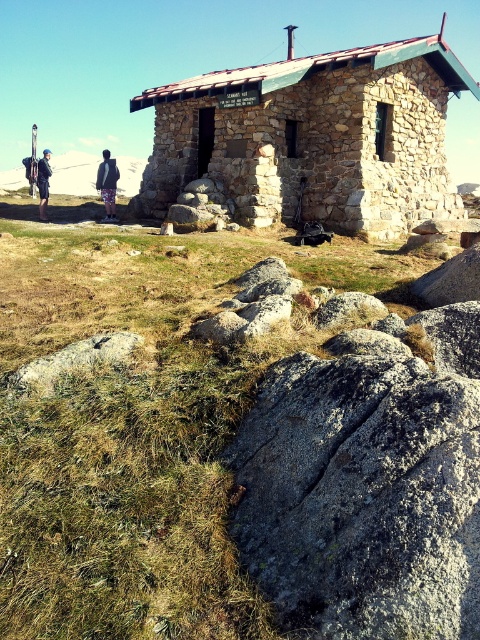
Looking at this image, you are a hiker who has reached the stone cabin at center and the printed fabric pants at center. Which object is positioned to the left?

The printed fabric pants at center are positioned to the left of the stone cabin at center.

You are an outdoor enthusiast planning to store your equipment in a small shed. You have the matte black skis at left and the printed fabric pants at center. Given their sizes, which item would require more storage space?

The matte black skis at left has a larger size compared to the printed fabric pants at center, so it would require more storage space.